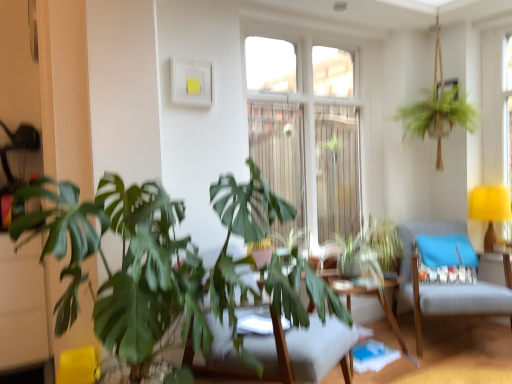
Question: In terms of height, does clear glass window at center look taller or shorter compared to green leafy plant at center?

Choices:
 (A) tall
 (B) short

Answer: (A)

Question: Looking at their shapes, would you say clear glass window at center is wider or thinner than green leafy plant at center?

Choices:
 (A) thin
 (B) wide

Answer: (A)

Question: Which object is the closest to the wooden table at center?

Choices:
 (A) blue fabric pillow at right
 (B) yellow fabric lampshade at right
 (C) clear glass window at center
 (D) green leafy plant at center
 (E) wooden swivel chair at center, which is the second swivel chair in back-to-front order

Answer: (A)

Question: Which is farther from the blue fabric pillow at right?

Choices:
 (A) clear glass window at center
 (B) wooden table at center
 (C) wooden swivel chair at center, which is the second swivel chair in back-to-front order
 (D) light blue fabric swivel chair at center right, the 1th swivel chair positioned from the back
 (E) green leafy plant at center

Answer: (E)